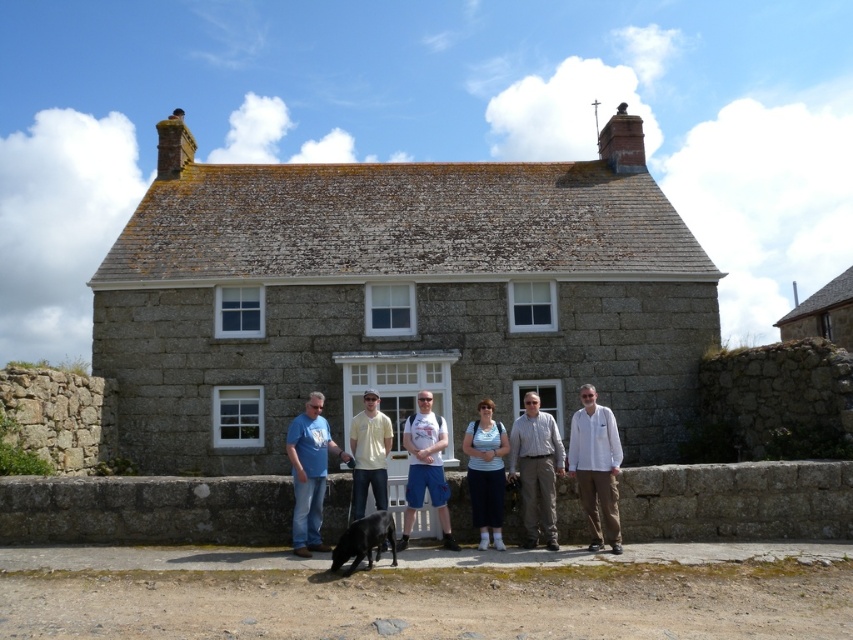
You are a photographer trying to capture a photo of the gray cotton shirt at center and the black fur dog at center. Which one should you focus on first to ensure both are in the same plane of focus?

The gray cotton shirt at center is further to the viewer than the black fur dog at center, so you should focus on the gray cotton shirt at center first to ensure both are in the same plane of focus.

You are standing at the origin point of the coordinate system. You want to move towards the matte blue shirt at center. Which direction should you move in?

You should move towards the coordinates point (486, 474) to reach the matte blue shirt at center.